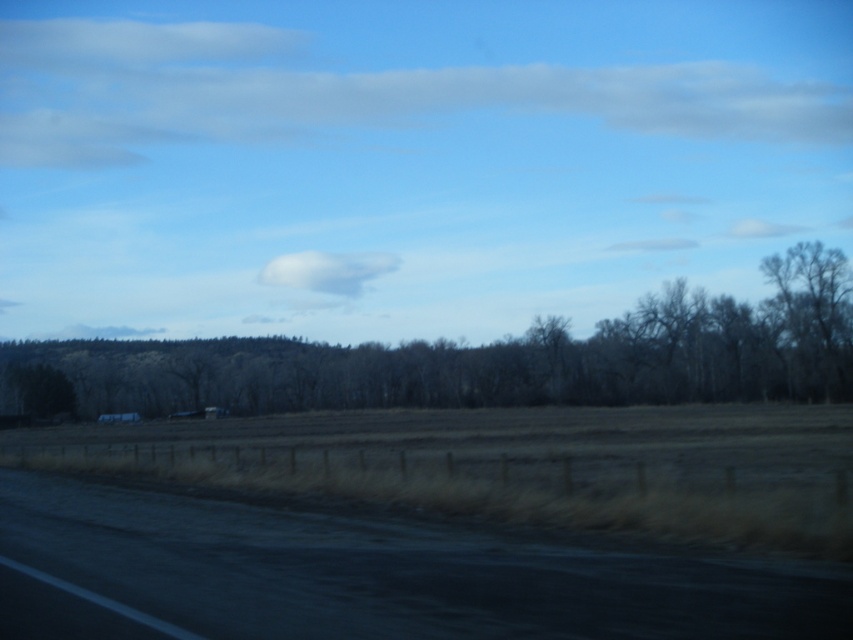
You are standing on the dark road with a white line marking its edge and looking towards the field. You notice two white fluffy clouds in the sky. Which cloud is positioned to the right when comparing the white fluffy cloud at upper center and the white fluffy cloud at center?

The white fluffy cloud at upper center is to the right of the white fluffy cloud at center.

You are standing at the point closer to the camera between the two points, point (370, 112) and point (358, 284). Which point are you standing at?

You are standing at point (370, 112) because it is further to the camera than point (358, 284).